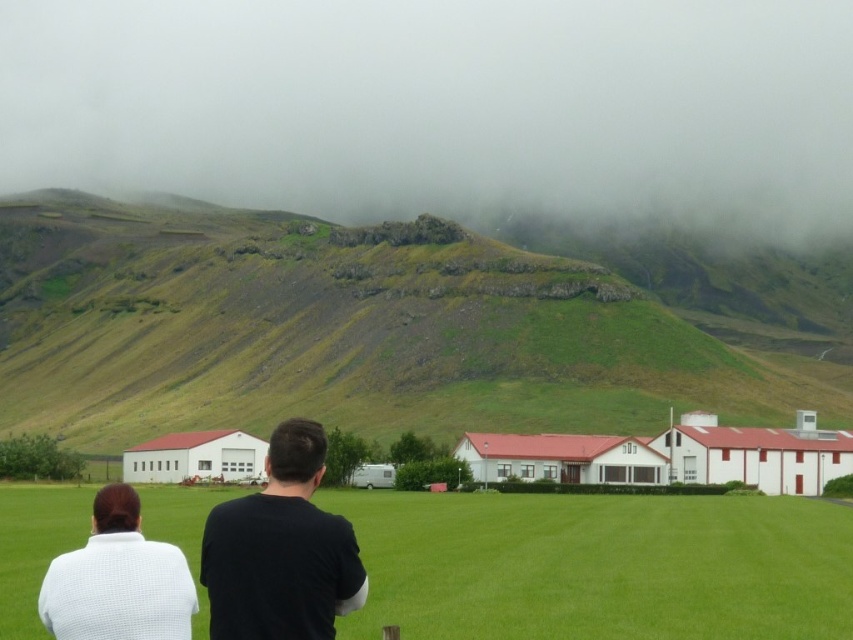
From the picture: Which of these two, foggy misty hillside at upper center or black matte shirt at center, stands taller?

With more height is foggy misty hillside at upper center.

Can you confirm if foggy misty hillside at upper center is positioned to the right of black matte shirt at center?

Incorrect, foggy misty hillside at upper center is not on the right side of black matte shirt at center.

Does point (39, 100) come farther from viewer compared to point (303, 436)?

Yes, point (39, 100) is farther from viewer.

Find the location of a particular element. This screenshot has width=853, height=640. foggy misty hillside at upper center is located at coordinates (444, 108).

Measure the distance between green grassy hillside at center and camera.

green grassy hillside at center is 158.70 meters away from camera.

Is green grassy hillside at center above green grass field at lower center?

Yes, green grassy hillside at center is above green grass field at lower center.

Locate an element on the screen. green grassy hillside at center is located at coordinates (381, 328).

The height and width of the screenshot is (640, 853). I want to click on green grass field at lower center, so click(599, 566).

This screenshot has height=640, width=853. Find the location of `green grass field at lower center`. green grass field at lower center is located at coordinates (599, 566).